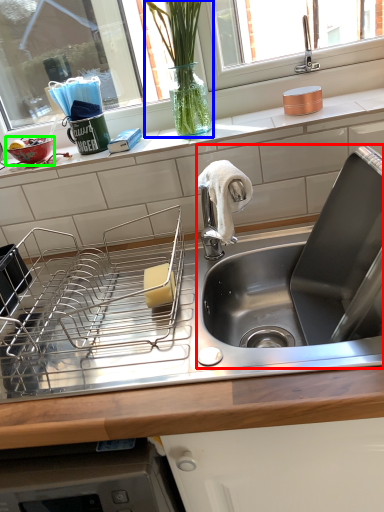
Question: Which object is the closest to the sink (highlighted by a red box)? Choose among these: plant (highlighted by a blue box) or basin (highlighted by a green box).

Choices:
 (A) plant
 (B) basin

Answer: (A)